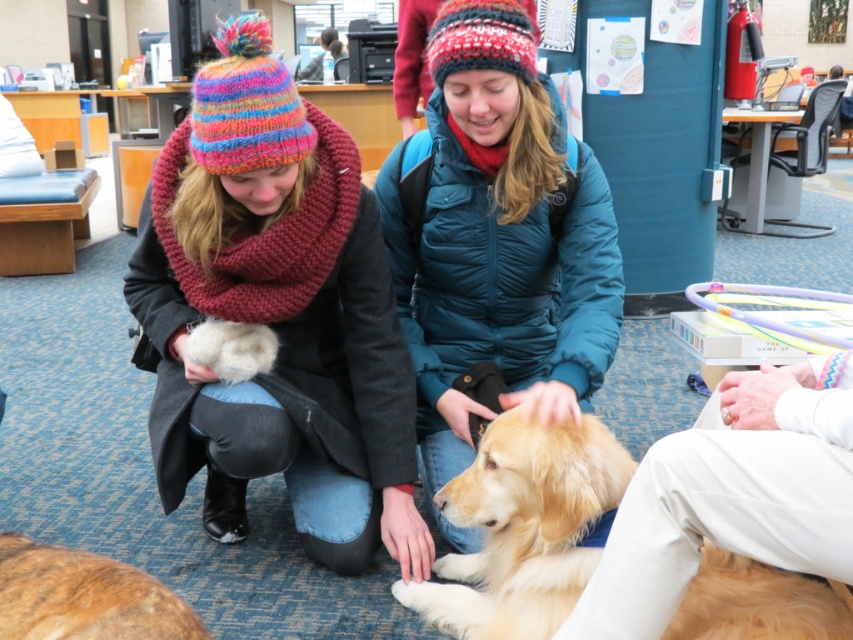
Question: Which object appears farthest from the camera in this image?

Choices:
 (A) golden fur dog at lower left
 (B) matte teal jacket at center

Answer: (B)

Question: From the image, what is the correct spatial relationship of knitted woolen hat at upper left in relation to golden fur dog at lower left?

Choices:
 (A) above
 (B) below

Answer: (A)

Question: Can you confirm if knitted woolen hat at upper left is positioned above golden fur dog at lower left?

Choices:
 (A) yes
 (B) no

Answer: (A)

Question: Among these objects, which one is nearest to the camera?

Choices:
 (A) golden fur dog at center
 (B) golden fur dog at lower left

Answer: (B)

Question: Which is farther from the golden fur dog at center?

Choices:
 (A) matte teal jacket at center
 (B) golden fur dog at lower left
 (C) knitted woolen hat at upper left

Answer: (B)

Question: Is golden fur dog at center to the left of golden fur dog at lower left from the viewer's perspective?

Choices:
 (A) no
 (B) yes

Answer: (A)